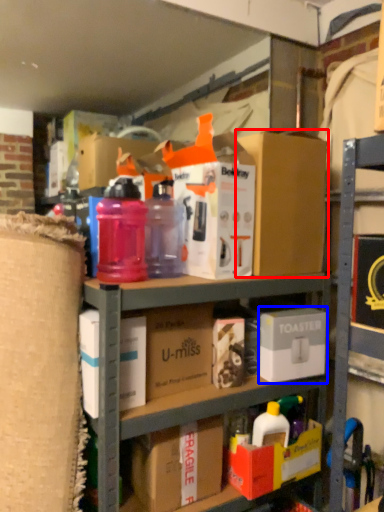
Question: Which point is closer to the camera, box (highlighted by a red box) or box (highlighted by a blue box)?

Choices:
 (A) box
 (B) box

Answer: (A)